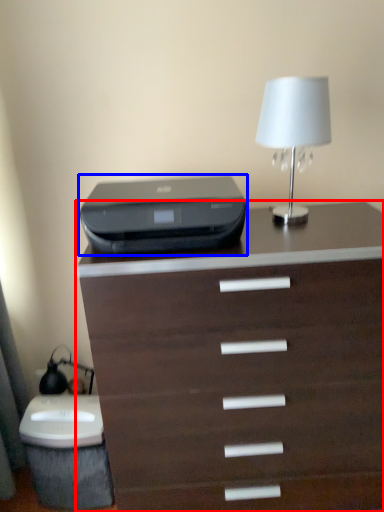
Question: Which of the following is the farthest to the observer, chest of drawers (highlighted by a red box) or printer (highlighted by a blue box)?

Choices:
 (A) chest of drawers
 (B) printer

Answer: (B)